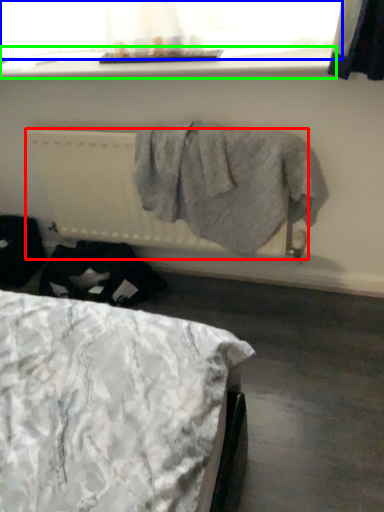
Question: Based on their relative distances, which object is farther from radiator (highlighted by a red box)? Choose from window screen (highlighted by a blue box) and window sill (highlighted by a green box).

Choices:
 (A) window screen
 (B) window sill

Answer: (A)